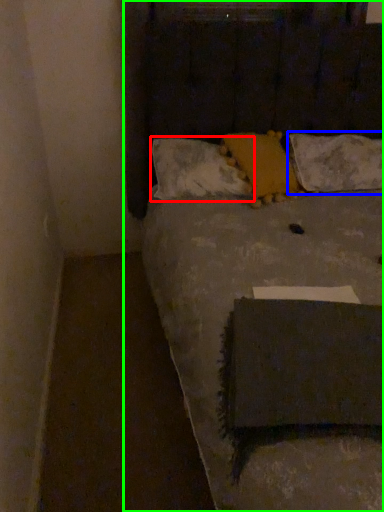
Question: Which object is the farthest from pillow (highlighted by a red box)? Choose among these: pillow (highlighted by a blue box) or bed (highlighted by a green box).

Choices:
 (A) pillow
 (B) bed

Answer: (A)